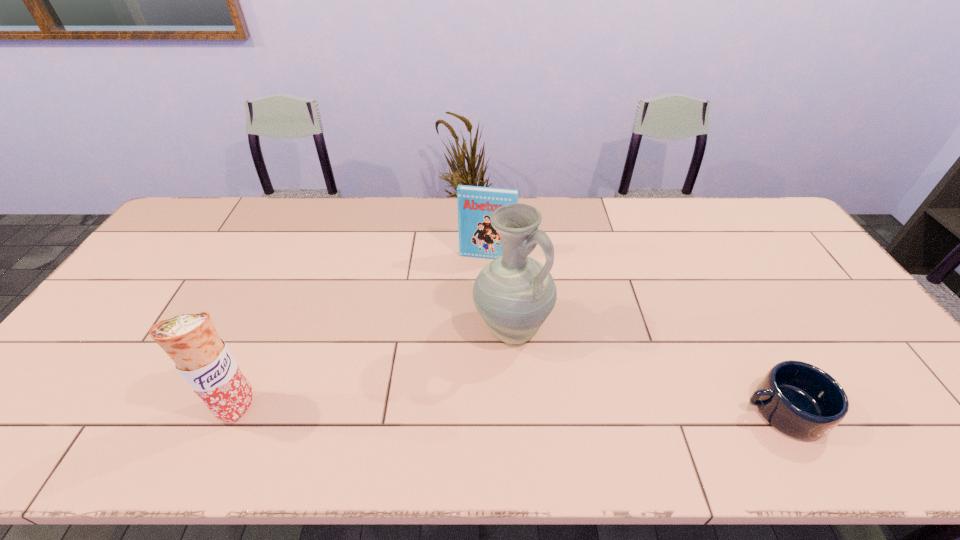
Where is `vacant space in between the third nearest object and the burrito`? vacant space in between the third nearest object and the burrito is located at coordinates (374, 368).

The image size is (960, 540). Identify the location of vacant space in between the pitcher and the shortest object. (647, 370).

You are a GUI agent. You are given a task and a screenshot of the screen. Output one action in this format:
    pyautogui.click(x=<x>, y=<y>)
    Task: Click on the vacant area between the mug and the third tallest object
    
    Given the screenshot: What is the action you would take?
    pyautogui.click(x=635, y=333)

I want to click on empty location between the leftmost object and the mug, so click(x=510, y=408).

Where is `object that can be found as the closest to the farthest object`? object that can be found as the closest to the farthest object is located at coordinates (514, 294).

Image resolution: width=960 pixels, height=540 pixels. I want to click on object that stands as the second closest to the farthest object, so click(x=202, y=358).

At what (x,y) coordinates should I click in order to perform the action: click on free space that satisfies the following two spatial constraints: 1. on the front side of the shortest object; 2. with the handle on the side of the book. Please return your answer as a coordinate pair (x, y). Looking at the image, I should click on (490, 410).

Identify the location of free space that satisfies the following two spatial constraints: 1. on the front side of the farthest object; 2. on the left side of the tallest object. The width and height of the screenshot is (960, 540). (488, 329).